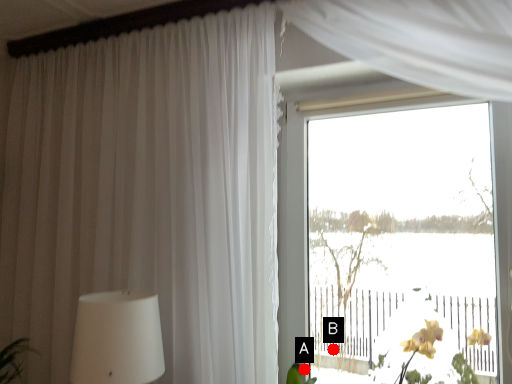
Question: Two points are circled on the image, labeled by A and B beside each circle. Which point is farther to the camera?

Choices:
 (A) A is further
 (B) B is further

Answer: (B)